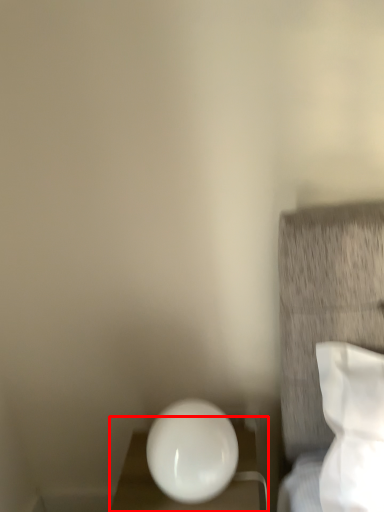
Question: In this image, where is furniture (annotated by the red box) located relative to oval?

Choices:
 (A) left
 (B) right

Answer: (B)